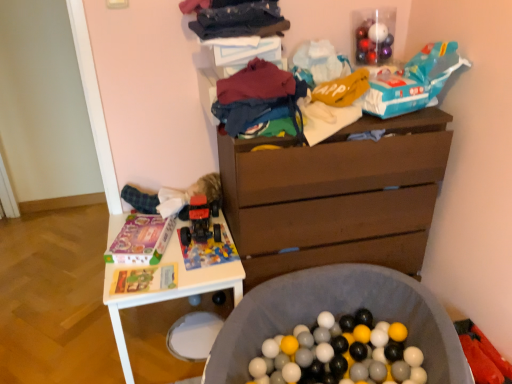
Describe the element at coordinates (335, 197) in the screenshot. This screenshot has width=512, height=384. I see `brown wooden chest of drawers at center` at that location.

Image resolution: width=512 pixels, height=384 pixels. Describe the element at coordinates (239, 20) in the screenshot. I see `dark blue fabric at upper center, the first clothing from the top` at that location.

What is the approximate width of teal cardboard box at upper right, arranged as the 1th toy when viewed from the right?

teal cardboard box at upper right, arranged as the 1th toy when viewed from the right, is 10.47 inches wide.

Measure the distance between point (412,91) and camera.

Point (412,91) and camera are 1.53 meters apart from each other.

In order to face white plastic table at lower left, should I rotate leftwards or rightwards?

To align with it, rotate left about 10.706°.

In order to face rubberized plastic toy car at center, which ranks as the 2th toy in top-to-bottom order, should I rotate leftwards or rightwards?

You should rotate left by 7.342 degrees.

Locate an element on the screen. The height and width of the screenshot is (384, 512). brick-patterned plastic toy car at center, the second toy when ordered from left to right is located at coordinates (209, 250).

Is brick-patterned plastic toy car at center, the 3th toy in the top-to-bottom sequence, positioned with its back to teal cardboard box at upper right, arranged as the 1th toy when viewed from the right?

No, brick-patterned plastic toy car at center, the 3th toy in the top-to-bottom sequence,'s orientation is not away from teal cardboard box at upper right, arranged as the 1th toy when viewed from the right.

Considering the relative sizes of brick-patterned plastic toy car at center, the 3th toy in the top-to-bottom sequence, and teal cardboard box at upper right, arranged as the 1th toy when viewed from the right, in the image provided, is brick-patterned plastic toy car at center, the 3th toy in the top-to-bottom sequence, taller than teal cardboard box at upper right, arranged as the 1th toy when viewed from the right,?

Incorrect, the height of brick-patterned plastic toy car at center, the 3th toy in the top-to-bottom sequence, is not larger of that of teal cardboard box at upper right, arranged as the 1th toy when viewed from the right.

How different are the orientations of brick-patterned plastic toy car at center, which appears as the second toy when viewed from the right, and teal cardboard box at upper right, positioned as the 3th toy in left-to-right order, in degrees?

There is a 18.1-degree angle between the facing directions of brick-patterned plastic toy car at center, which appears as the second toy when viewed from the right, and teal cardboard box at upper right, positioned as the 3th toy in left-to-right order.

Relative to teal cardboard box at upper right, positioned as the 3th toy in left-to-right order, is brick-patterned plastic toy car at center, which appears as the second toy when viewed from the right, in front or behind?

brick-patterned plastic toy car at center, which appears as the second toy when viewed from the right, is behind teal cardboard box at upper right, positioned as the 3th toy in left-to-right order.

Can you confirm if teal cardboard box at upper right, arranged as the 1th toy when viewed from the right, is wider than white plastic table at lower left?

No, teal cardboard box at upper right, arranged as the 1th toy when viewed from the right, is not wider than white plastic table at lower left.

Considering the relative sizes of teal cardboard box at upper right, the 3th toy when ordered from bottom to top, and white plastic table at lower left in the image provided, is teal cardboard box at upper right, the 3th toy when ordered from bottom to top, smaller than white plastic table at lower left?

Yes, teal cardboard box at upper right, the 3th toy when ordered from bottom to top, is smaller than white plastic table at lower left.

I want to click on table lying below the teal cardboard box at upper right, the 3th toy when ordered from bottom to top (from the image's perspective), so click(169, 290).

In the scene shown: Which object is closer to the camera, brown wooden chest of drawers at center or dark blue fabric at upper center, the first clothing from the top?

dark blue fabric at upper center, the first clothing from the top, is more forward.

Which of these two, brown wooden chest of drawers at center or dark blue fabric at upper center, acting as the 2th clothing starting from the bottom, stands shorter?

With less height is dark blue fabric at upper center, acting as the 2th clothing starting from the bottom.

From the image's perspective, relative to dark blue fabric at upper center, acting as the 2th clothing starting from the bottom, is brown wooden chest of drawers at center above or below?

brown wooden chest of drawers at center is below dark blue fabric at upper center, acting as the 2th clothing starting from the bottom.

Measure the distance from brown wooden chest of drawers at center to dark blue fabric at upper center, acting as the 2th clothing starting from the bottom.

brown wooden chest of drawers at center and dark blue fabric at upper center, acting as the 2th clothing starting from the bottom, are 24.87 inches apart.

Could you tell me if teal cardboard box at upper right, the first toy in the top-to-bottom sequence, is turned towards multicolored fabric at center, which is counted as the second clothing, starting from the top?

No, teal cardboard box at upper right, the first toy in the top-to-bottom sequence, is not aimed at multicolored fabric at center, which is counted as the second clothing, starting from the top.

From a real-world perspective, is teal cardboard box at upper right, positioned as the 3th toy in left-to-right order, physically below multicolored fabric at center, marked as the 1th clothing in a bottom-to-top arrangement?

Incorrect, from a real-world perspective, teal cardboard box at upper right, positioned as the 3th toy in left-to-right order, is higher than multicolored fabric at center, marked as the 1th clothing in a bottom-to-top arrangement.

From the image's perspective, would you say brick-patterned plastic toy car at center, which appears as the second toy when viewed from the right, is shown under dark blue fabric at upper center, acting as the 2th clothing starting from the bottom?

Yes, from the image's perspective, brick-patterned plastic toy car at center, which appears as the second toy when viewed from the right, is below dark blue fabric at upper center, acting as the 2th clothing starting from the bottom.

Is brick-patterned plastic toy car at center, the second toy when ordered from left to right, smaller than dark blue fabric at upper center, the first clothing from the top?

Yes, brick-patterned plastic toy car at center, the second toy when ordered from left to right, is smaller than dark blue fabric at upper center, the first clothing from the top.

How many degrees apart are the facing directions of brick-patterned plastic toy car at center, which ranks as the first toy in bottom-to-top order, and dark blue fabric at upper center, acting as the 2th clothing starting from the bottom?

The angle between the facing direction of brick-patterned plastic toy car at center, which ranks as the first toy in bottom-to-top order, and the facing direction of dark blue fabric at upper center, acting as the 2th clothing starting from the bottom, is 6.58 degrees.

Does brick-patterned plastic toy car at center, which ranks as the first toy in bottom-to-top order, have a greater height compared to dark blue fabric at upper center, the first clothing from the top?

No.

In the scene shown: Which is closer to the camera, (252, 115) or (209, 238)?

Point (252, 115)

From their relative heights in the image, would you say multicolored fabric at center, marked as the 1th clothing in a bottom-to-top arrangement, is taller or shorter than brick-patterned plastic toy car at center, the 3th toy in the top-to-bottom sequence?

multicolored fabric at center, marked as the 1th clothing in a bottom-to-top arrangement, is taller than brick-patterned plastic toy car at center, the 3th toy in the top-to-bottom sequence.

Locate an element on the screen. toy that is the 2nd one below the multicolored fabric at center, marked as the 1th clothing in a bottom-to-top arrangement (from a real-world perspective) is located at coordinates (209, 250).

Considering the relative sizes of multicolored fabric at center, marked as the 1th clothing in a bottom-to-top arrangement, and brick-patterned plastic toy car at center, which ranks as the first toy in bottom-to-top order, in the image provided, is multicolored fabric at center, marked as the 1th clothing in a bottom-to-top arrangement, smaller than brick-patterned plastic toy car at center, which ranks as the first toy in bottom-to-top order,?

No.

Consider the image. Which is correct: rubberized plastic toy car at center, which is the 3th toy in right-to-left order, is inside brown wooden chest of drawers at center, or outside of it?

The correct answer is: outside.

From a real-world perspective, relative to brown wooden chest of drawers at center, is rubberized plastic toy car at center, which is the 3th toy in right-to-left order, vertically above or below?

rubberized plastic toy car at center, which is the 3th toy in right-to-left order, is situated higher than brown wooden chest of drawers at center in the real world.

Is point (194, 238) positioned in front of point (383, 262)?

Yes, point (194, 238) is in front of point (383, 262).

What are the coordinates of `the 1st toy behind the teal cardboard box at upper right, arranged as the 1th toy when viewed from the right` in the screenshot? It's located at (209, 250).

The width and height of the screenshot is (512, 384). In order to click on table below the teal cardboard box at upper right, positioned as the 3th toy in left-to-right order (from a real-world perspective) in this screenshot , I will do `click(169, 290)`.

Based on their spatial positions, is brick-patterned plastic toy car at center, the 3th toy in the top-to-bottom sequence, or white plastic table at lower left closer to brown wooden chest of drawers at center?

Among the two, brick-patterned plastic toy car at center, the 3th toy in the top-to-bottom sequence, is located nearer to brown wooden chest of drawers at center.

When comparing their distances from teal cardboard box at upper right, arranged as the 1th toy when viewed from the right, does rubberized plastic toy car at center, positioned as the 1th toy in left-to-right order, or white plastic table at lower left seem closer?

Among the two, rubberized plastic toy car at center, positioned as the 1th toy in left-to-right order, is located nearer to teal cardboard box at upper right, arranged as the 1th toy when viewed from the right.

Based on their spatial positions, is brown wooden chest of drawers at center or white plastic table at lower left closer to rubberized plastic toy car at center, the 2th toy ordered from the bottom?

white plastic table at lower left is closer to rubberized plastic toy car at center, the 2th toy ordered from the bottom.

Looking at the image, which one is located further to white plastic table at lower left, teal cardboard box at upper right, the first toy in the top-to-bottom sequence, or brown wooden chest of drawers at center?

Among the two, teal cardboard box at upper right, the first toy in the top-to-bottom sequence, is located further to white plastic table at lower left.

From the picture: When comparing their distances from dark blue fabric at upper center, the first clothing from the top, does rubberized plastic toy car at center, which is the 3th toy in right-to-left order, or white plastic table at lower left seem closer?

Based on the image, rubberized plastic toy car at center, which is the 3th toy in right-to-left order, appears to be nearer to dark blue fabric at upper center, the first clothing from the top.

Looking at the image, which one is located further to multicolored fabric at center, marked as the 1th clothing in a bottom-to-top arrangement, dark blue fabric at upper center, acting as the 2th clothing starting from the bottom, or white plastic table at lower left?

Based on the image, white plastic table at lower left appears to be further to multicolored fabric at center, marked as the 1th clothing in a bottom-to-top arrangement.

Based on the photo, based on their spatial positions, is brick-patterned plastic toy car at center, the 3th toy in the top-to-bottom sequence, or dark blue fabric at upper center, the first clothing from the top, closer to brown wooden chest of drawers at center?

Among the two, brick-patterned plastic toy car at center, the 3th toy in the top-to-bottom sequence, is located nearer to brown wooden chest of drawers at center.

Considering their positions, is brick-patterned plastic toy car at center, which appears as the second toy when viewed from the right, positioned closer to white plastic table at lower left than rubberized plastic toy car at center, which is the 3th toy in right-to-left order?

Among the two, brick-patterned plastic toy car at center, which appears as the second toy when viewed from the right, is located nearer to white plastic table at lower left.

Locate an element on the screen. The height and width of the screenshot is (384, 512). chest of drawers between dark blue fabric at upper center, the first clothing from the top, and white plastic table at lower left, in the vertical direction is located at coordinates (335, 197).

What are the coordinates of `the chest of drawers between dark blue fabric at upper center, the first clothing from the top, and brick-patterned plastic toy car at center, the 3th toy in the top-to-bottom sequence, vertically` in the screenshot? It's located at (335, 197).

Find the location of `toy between rubberized plastic toy car at center, which is the 3th toy in right-to-left order, and brown wooden chest of drawers at center`. toy between rubberized plastic toy car at center, which is the 3th toy in right-to-left order, and brown wooden chest of drawers at center is located at coordinates (209, 250).

Locate an element on the screen. This screenshot has width=512, height=384. clothing between dark blue fabric at upper center, acting as the 2th clothing starting from the bottom, and white plastic table at lower left, in the vertical direction is located at coordinates coord(254,95).